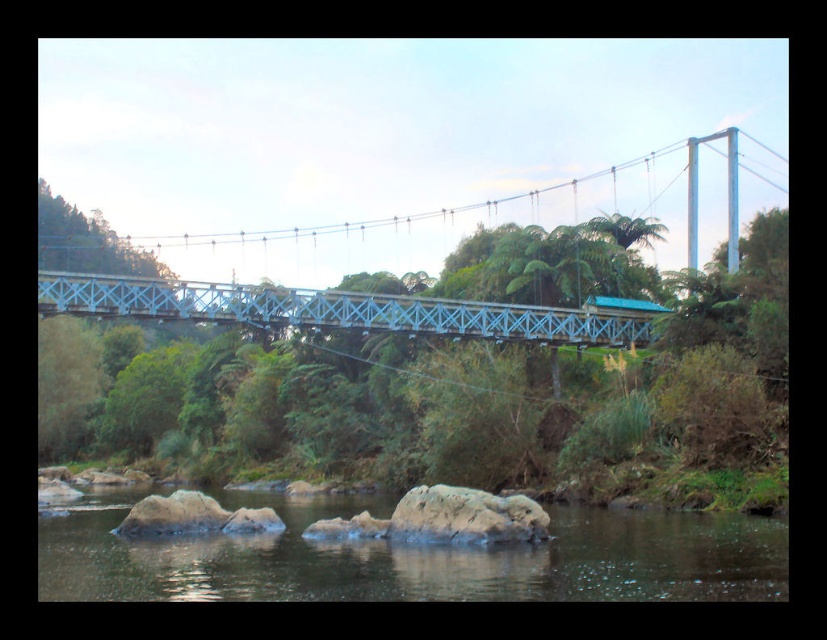
You are standing at the starting point of the suspension bridge and see two points marked on the bridge. The first point is at coordinates point (681,596) and the second point is at point (457,497). Which point is closer to you as you begin walking on the bridge?

Point (681,596) is in front of point (457,497), so the point closer to you as you begin walking on the bridge is point (681,596).